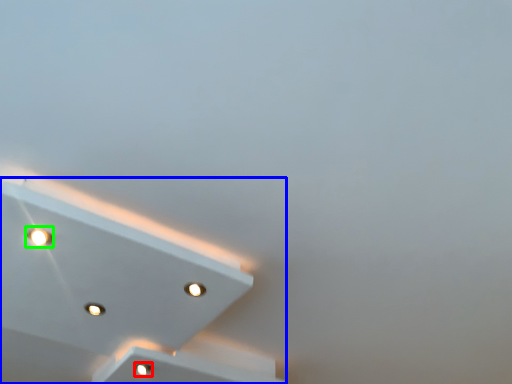
Question: Considering the real-world distances, which object is farthest from dot (highlighted by a red box)? lamp (highlighted by a blue box) or dot (highlighted by a green box)?

Choices:
 (A) lamp
 (B) dot

Answer: (B)